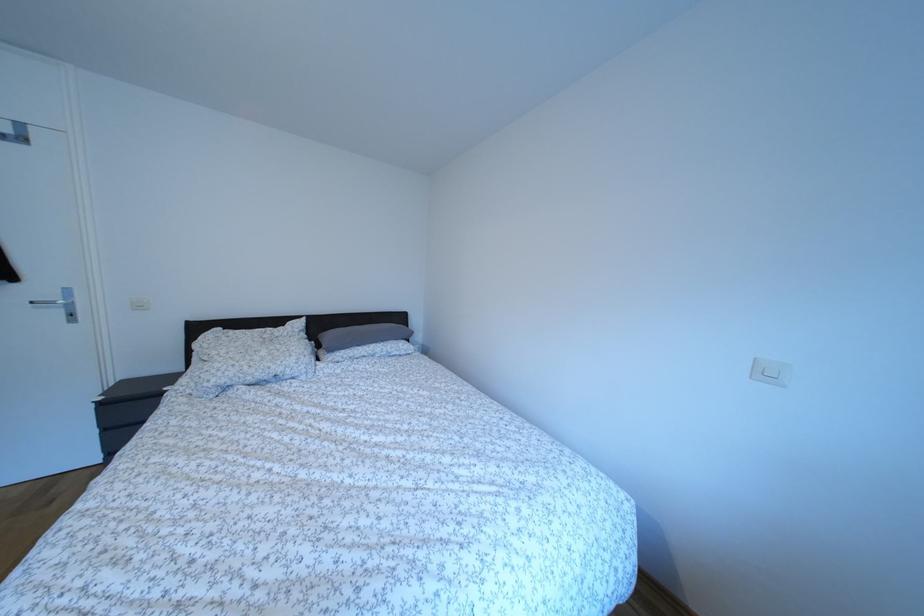
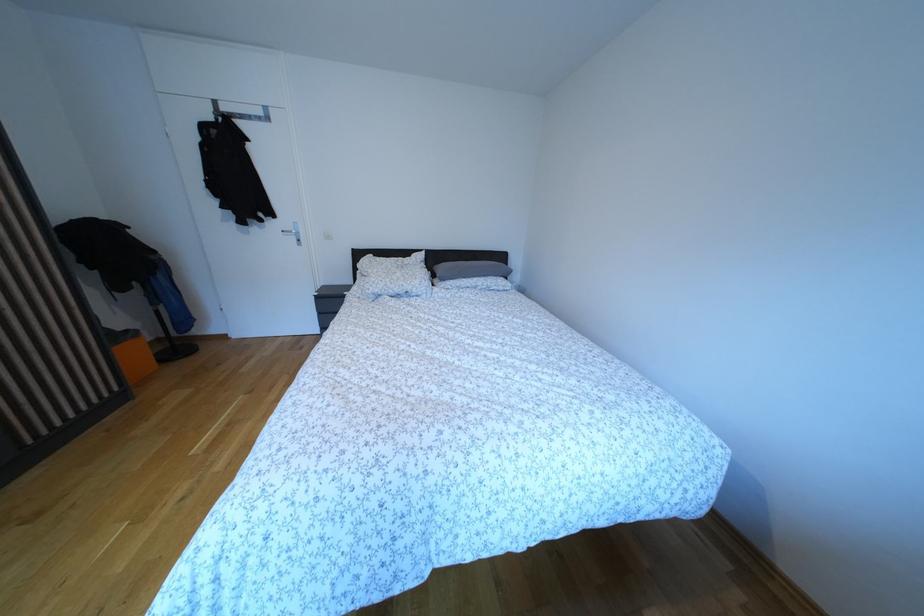
Find the pixel in the second image that matches point 334,342 in the first image.

(447, 274)